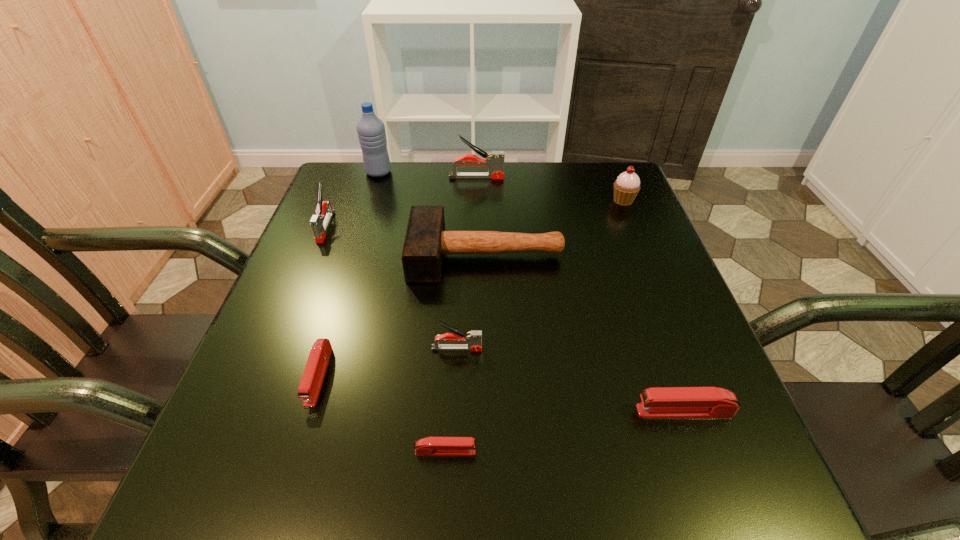
You are a GUI agent. You are given a task and a screenshot of the screen. Output one action in this format:
    pyautogui.click(x=<x>, y=<y>)
    Task: Click on the vacant region between the mallet and the nearest gray stapler
    The height and width of the screenshot is (540, 960).
    Given the screenshot: What is the action you would take?
    pyautogui.click(x=471, y=302)

This screenshot has width=960, height=540. In order to click on vacant space that is in between the nearest gray stapler and the biggest gray stapler in this screenshot , I will do `click(467, 263)`.

Find the location of a particular element. This screenshot has height=540, width=960. free space between the water bottle and the cupcake is located at coordinates (501, 186).

The width and height of the screenshot is (960, 540). What are the coordinates of `the eighth closest object to the smallest red stapler` in the screenshot? It's located at (371, 131).

This screenshot has height=540, width=960. Identify the location of the eighth closest object to the mallet. (431, 446).

Choose which stapler is the third nearest neighbor to the shortest stapler. Please provide its 2D coordinates. Your answer should be formatted as a tuple, i.e. [(x, y)], where the tuple contains the x and y coordinates of a point satisfying the conditions above.

[(665, 402)]

Where is `the fourth closest stapler relative to the nearest object`? The height and width of the screenshot is (540, 960). the fourth closest stapler relative to the nearest object is located at coordinates (319, 223).

Locate which gray stapler is the third closest to the mallet. Please provide its 2D coordinates. Your answer should be formatted as a tuple, i.e. [(x, y)], where the tuple contains the x and y coordinates of a point satisfying the conditions above.

[(494, 161)]

You are a GUI agent. You are given a task and a screenshot of the screen. Output one action in this format:
    pyautogui.click(x=<x>, y=<y>)
    Task: Click on the gray stapler object that ranks as the closest to the tallest stapler
    The width and height of the screenshot is (960, 540).
    Given the screenshot: What is the action you would take?
    pyautogui.click(x=319, y=223)

Locate which red stapler ranks in proximity to the mallet. Please provide its 2D coordinates. Your answer should be formatted as a tuple, i.e. [(x, y)], where the tuple contains the x and y coordinates of a point satisfying the conditions above.

[(314, 372)]